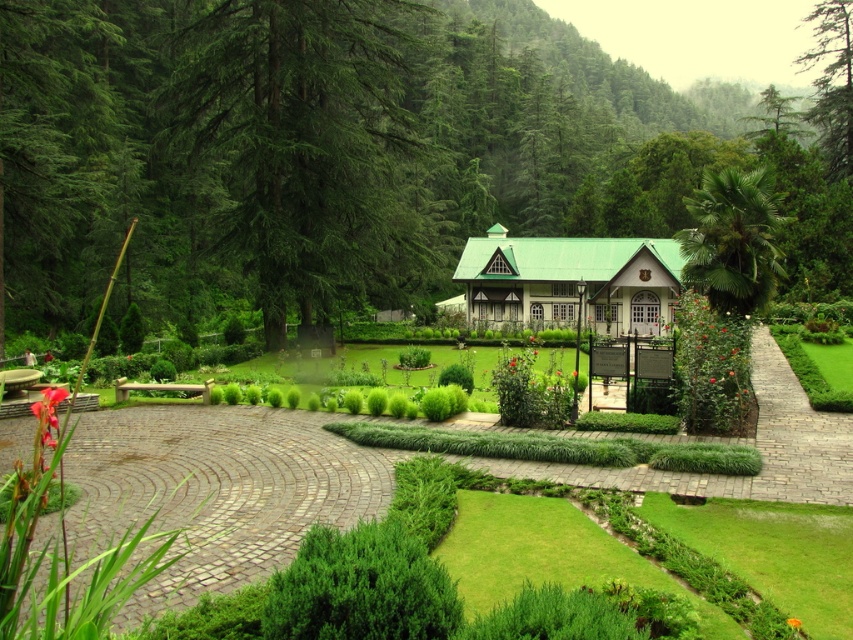
You are standing at the entrance of the building and want to take a photo of the green textured tree at upper left. In which direction should you walk to get a clear view of the tree?

The green textured tree at upper left is located at point (312, 150), so you should walk towards the upper left direction to get a clear view of the tree.

You are planning to host a small gathering in the garden and need to place a 3m by 3m tent. Given the green wooden cottage at center and the red matte flower at center, which object can accommodate the tent without overlapping?

The green wooden cottage at center has a larger size compared to the red matte flower at center, so the tent can be placed near the green wooden cottage at center as it has more space.